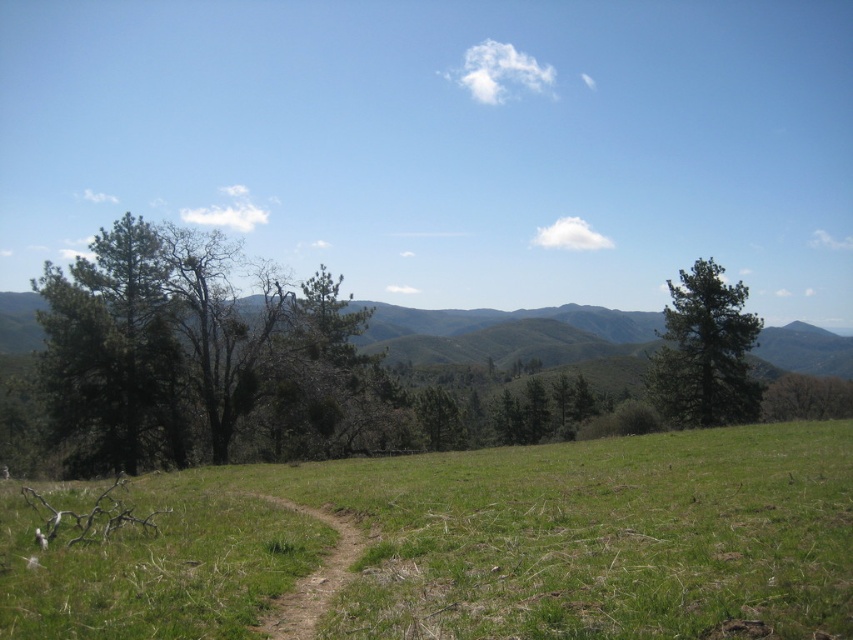
Can you confirm if green grassy field at center is shorter than green matte tree at right?

Indeed, green grassy field at center has a lesser height compared to green matte tree at right.

Is point (206, 525) closer to camera compared to point (727, 420)?

Yes, point (206, 525) is closer to viewer.

The height and width of the screenshot is (640, 853). Find the location of `green grassy field at center`. green grassy field at center is located at coordinates (477, 544).

Between green matte tree at right and brown dirt path at center, which one has less height?

brown dirt path at center is shorter.

Is green matte tree at right bigger than brown dirt path at center?

Indeed, green matte tree at right has a larger size compared to brown dirt path at center.

Is point (727, 336) positioned in front of point (314, 593)?

No, (727, 336) is behind (314, 593).

Locate an element on the screen. green matte tree at right is located at coordinates (705, 353).

In the scene shown: Is green matte tree at left thinner than green matte tree at right?

No, green matte tree at left is not thinner than green matte tree at right.

Is green matte tree at left to the right of green matte tree at right from the viewer's perspective?

In fact, green matte tree at left is to the left of green matte tree at right.

At what (x,y) coordinates should I click in order to perform the action: click on green matte tree at left. Please return your answer as a coordinate pair (x, y). The image size is (853, 640). Looking at the image, I should click on (196, 353).